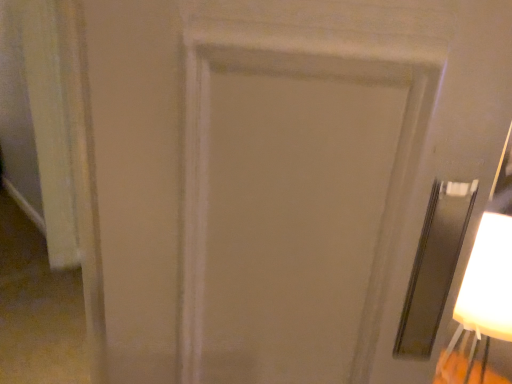
Where is `matte white lampshade at right`? The width and height of the screenshot is (512, 384). matte white lampshade at right is located at coordinates (485, 292).

The image size is (512, 384). Describe the element at coordinates (485, 292) in the screenshot. I see `matte white lampshade at right` at that location.

The height and width of the screenshot is (384, 512). In order to click on matte white lampshade at right in this screenshot , I will do `click(485, 292)`.